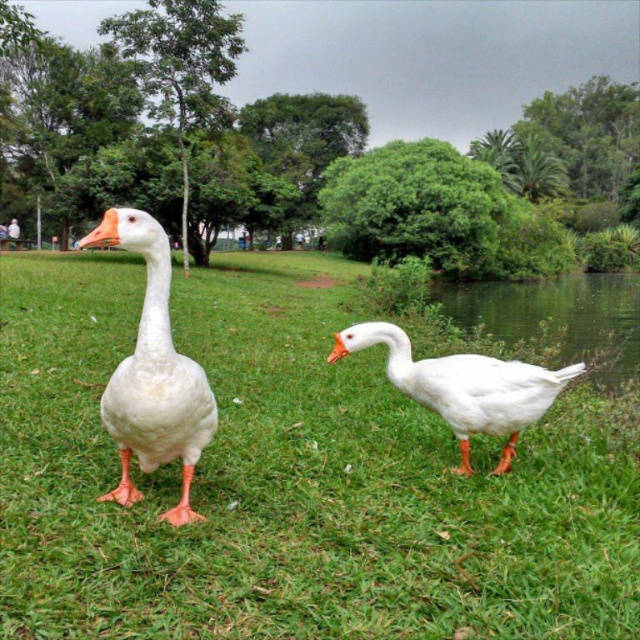
You are standing in the park and want to know how far the point at coordinates (625, 282) is from where you are. Can you determine the distance?

The point at coordinates (625, 282) is 192.86 feet away from you.

You are a photographer standing at the edge of the park. You want to take a photo of the white glossy goose at center and the white matte grass at center. How far apart are these two elements in the scene?

The white matte grass at center is 37.46 meters away from the white glossy goose at center, so the distance between them is 37.46 meters.